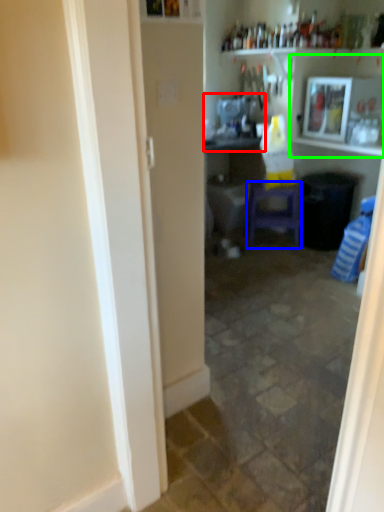
Question: Which object is positioned farthest from sink (highlighted by a red box)? Select from furniture (highlighted by a blue box) and shelf (highlighted by a green box).

Choices:
 (A) furniture
 (B) shelf

Answer: (A)